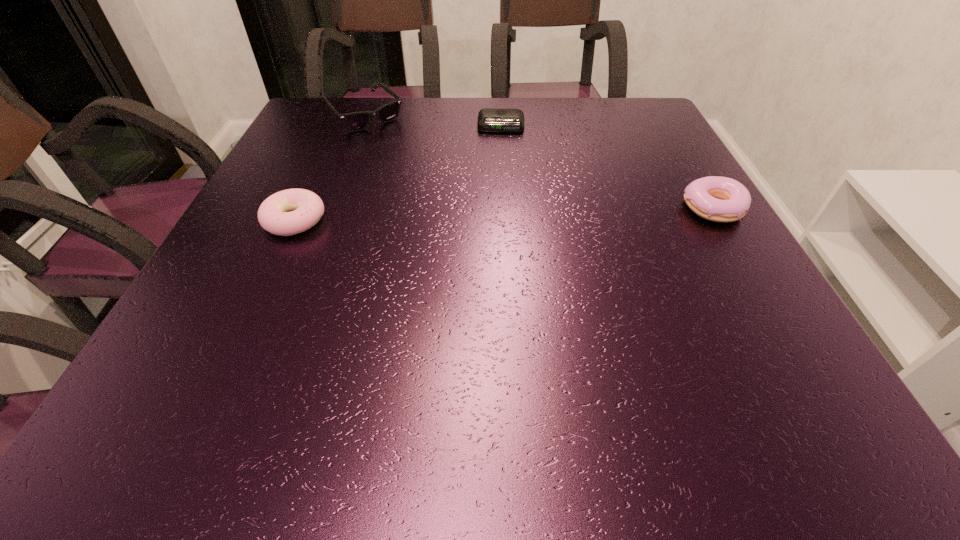
You are a GUI agent. You are given a task and a screenshot of the screen. Output one action in this format:
    pyautogui.click(x=<x>, y=<y>)
    Task: Click on the free space between the rightmost object and the third object from left to right
    This screenshot has width=960, height=540.
    Given the screenshot: What is the action you would take?
    pyautogui.click(x=607, y=167)

This screenshot has width=960, height=540. I want to click on vacant region between the second shortest object and the shortest object, so click(397, 173).

Where is `vacant point located between the right doughnut and the left doughnut`? The image size is (960, 540). vacant point located between the right doughnut and the left doughnut is located at coordinates (504, 214).

Locate an element on the screen. free point between the sunglasses and the right doughnut is located at coordinates (539, 162).

Locate an element on the screen. This screenshot has height=540, width=960. blank region between the right doughnut and the left doughnut is located at coordinates (504, 214).

Identify the location of empty location between the alarm clock and the third tallest object. This screenshot has height=540, width=960. point(397,173).

You are a GUI agent. You are given a task and a screenshot of the screen. Output one action in this format:
    pyautogui.click(x=<x>, y=<y>)
    Task: Click on the empty space between the sunglasses and the shorter doughnut
    
    Given the screenshot: What is the action you would take?
    pyautogui.click(x=330, y=168)

The image size is (960, 540). Identify the location of free space between the third object from left to right and the sunglasses. (433, 121).

This screenshot has width=960, height=540. Find the location of `object that is the closest to the sunglasses`. object that is the closest to the sunglasses is located at coordinates (489, 119).

At what (x,y) coordinates should I click in order to perform the action: click on the closest object to the shortest object. Please return your answer as a coordinate pair (x, y). The width and height of the screenshot is (960, 540). Looking at the image, I should click on (356, 121).